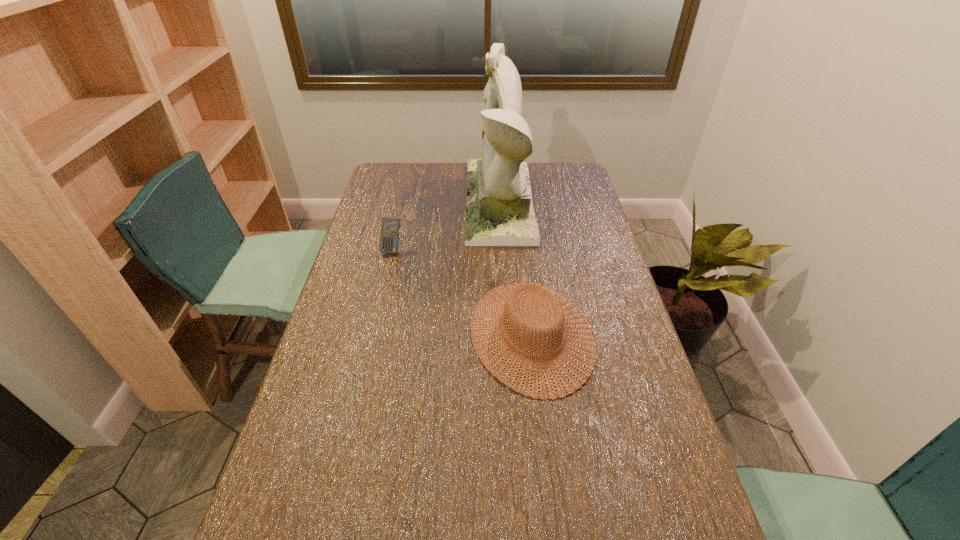
At what (x,y) coordinates should I click in order to perform the action: click on the tallest object. Please return your answer as a coordinate pair (x, y). The height and width of the screenshot is (540, 960). Looking at the image, I should click on (499, 212).

Locate an element on the screen. The width and height of the screenshot is (960, 540). calculator is located at coordinates (389, 237).

At what (x,y) coordinates should I click in order to perform the action: click on the nearest object. Please return your answer as a coordinate pair (x, y). The height and width of the screenshot is (540, 960). Looking at the image, I should click on (549, 304).

The width and height of the screenshot is (960, 540). In order to click on vacant area located on the base of the sculpture in this screenshot , I will do `click(401, 201)`.

Where is `vacant region located 0.090m on the base of the sculpture`? This screenshot has height=540, width=960. vacant region located 0.090m on the base of the sculpture is located at coordinates (444, 201).

At what (x,y) coordinates should I click in order to perform the action: click on free space located 0.360m on the base of the sculpture. Please return your answer as a coordinate pair (x, y). This screenshot has width=960, height=540. Looking at the image, I should click on click(376, 201).

Where is `vacant area situated on the front-facing side of the leftmost object`? vacant area situated on the front-facing side of the leftmost object is located at coordinates (381, 298).

Locate an element on the screen. free spot located on the front of the sunhat is located at coordinates [x=548, y=478].

Find the location of `object situated at the far edge`. object situated at the far edge is located at coordinates (499, 212).

Where is `object that is at the left edge`? object that is at the left edge is located at coordinates [x=389, y=237].